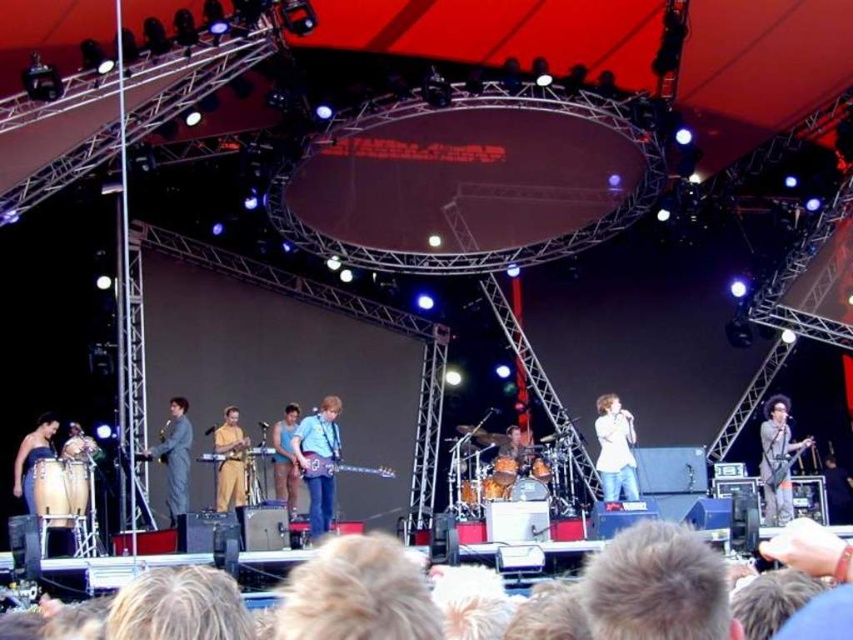
You are a photographer standing at the camera position. You want to capture a closeup shot of the golden fabric dress at center. Given that your camera can focus on subjects within 50 meters, will you be able to capture the dress clearly?

The golden fabric dress at center is 54.99 meters away from the camera. Since the camera can only focus within 50 meters, the dress is slightly out of range and cannot be captured clearly.

You are a photographer at the back of the stage. You need to take a photo that includes both the golden fabric dress at center and the blue fabric shirt at center. Which one should you adjust your camera angle to ensure the shorter one is fully visible?

Since the golden fabric dress at center is not as tall as the blue fabric shirt at center, you should lower your camera angle slightly to ensure the shorter golden fabric dress at center is fully visible in the photo.